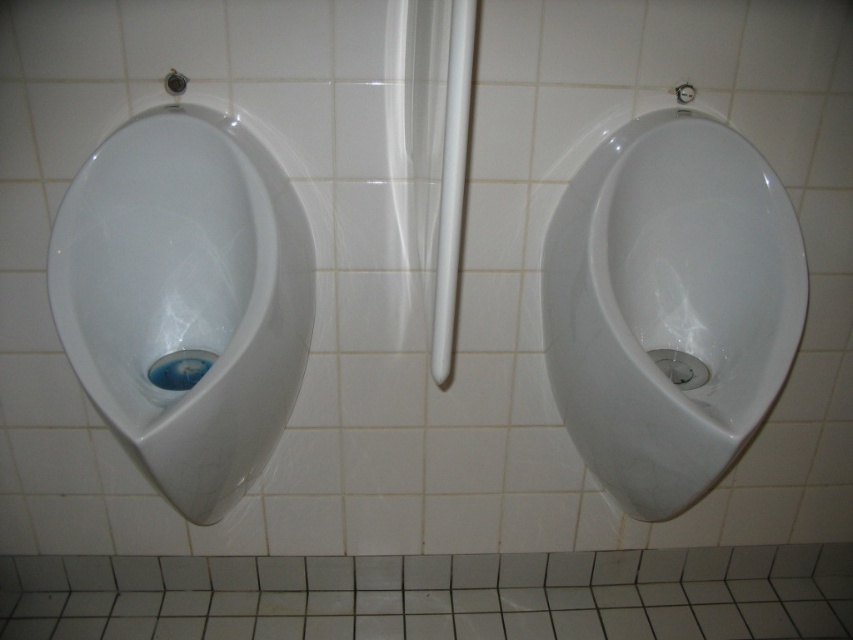
You are a maintenance worker inspecting two urinals in a restroom. You notice that the white glossy urinal at center and the white glossy urinal at left have different heights. Which one requires adjustment to ensure proper drainage according to standard plumbing codes?

The white glossy urinal at left requires adjustment because it is shorter than the white glossy urinal at center, and standard plumbing codes typically require consistent heights for proper drainage.

You are a maintenance worker inspecting the urinals. You notice that the white glossy urinal at center is positioned to the right of the white glossy urinal at left. Which urinal is closer to the right wall?

The white glossy urinal at center is closer to the right wall because it is positioned to the right of the white glossy urinal at left.

From the picture: You are a maintenance worker checking the urinals. You need to replace a part that fits only on the wider urinal. Which urinal should you choose between the white glossy urinal at center and the white glossy urinal at left?

The white glossy urinal at center is wider than the white glossy urinal at left, so you should choose the white glossy urinal at center for the part replacement.